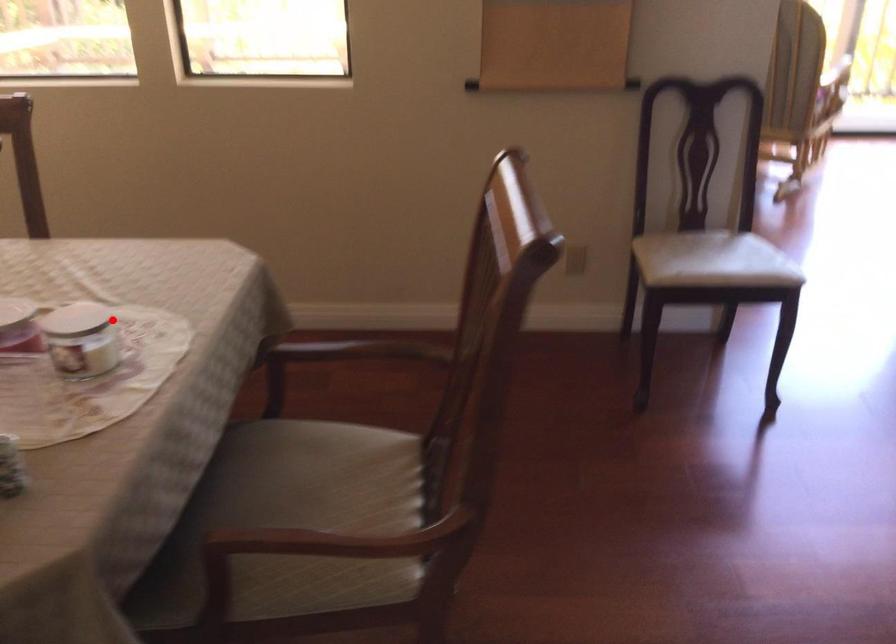
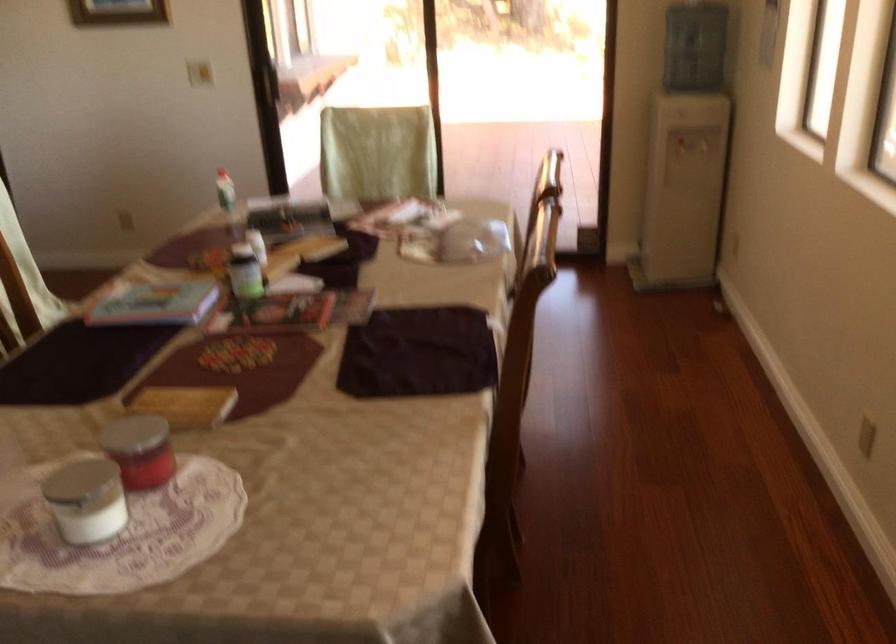
Where in the second image is the point corresponding to the highlighted location from the first image?

(85, 500)